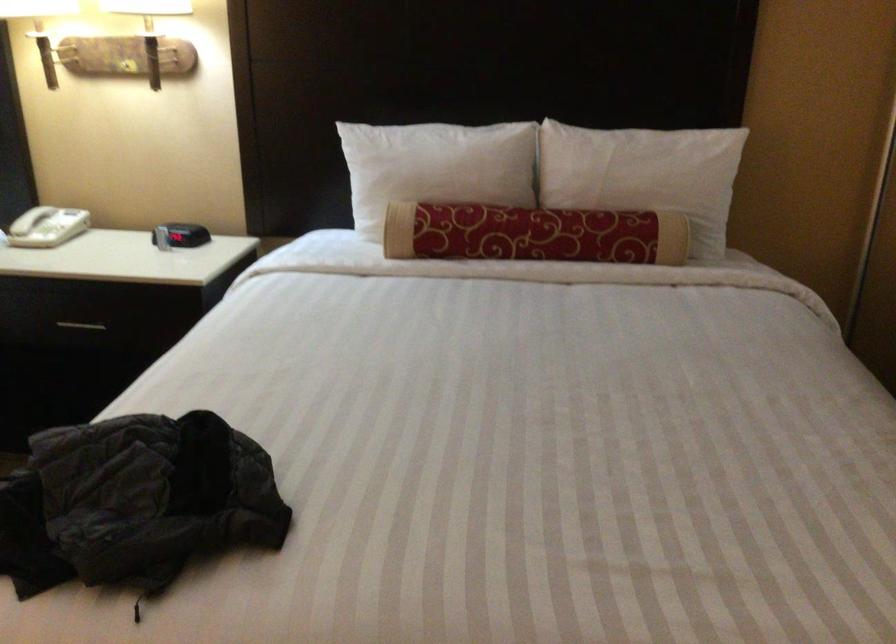
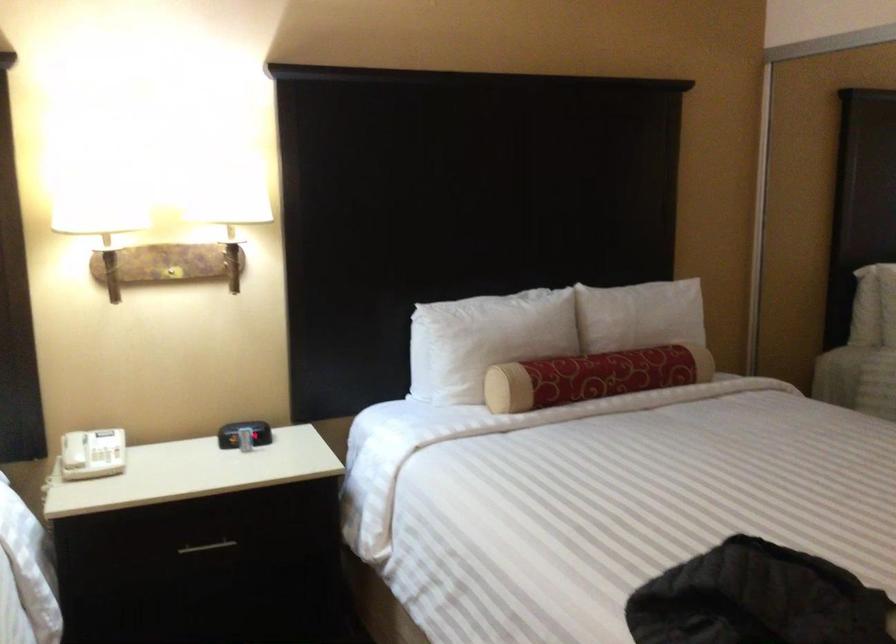
Where in the second image is the point corresponding to (394,173) from the first image?

(485, 339)